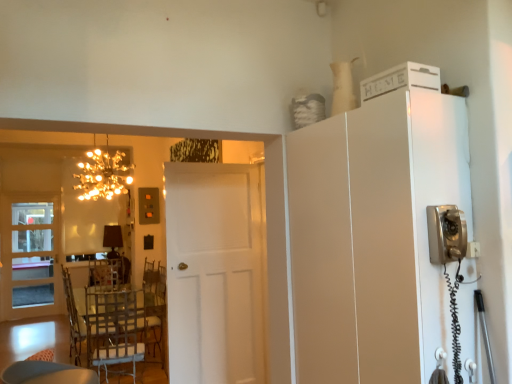
Question: Considering the positions of satin silver telephone at right, which is counted as the 1th appliance, starting from the front, and gold metallic chandelier at upper left in the image, is satin silver telephone at right, which is counted as the 1th appliance, starting from the front, wider or thinner than gold metallic chandelier at upper left?

Choices:
 (A) thin
 (B) wide

Answer: (A)

Question: From a real-world perspective, relative to gold metallic chandelier at upper left, is satin silver telephone at right, which is counted as the 1th appliance, starting from the front, vertically above or below?

Choices:
 (A) above
 (B) below

Answer: (B)

Question: Estimate the real-world distances between objects in this image. Which object is farther from the white matte cabinet at upper right?

Choices:
 (A) white matte door at center, positioned as the 2th door in left-to-right order
 (B) gold metallic chandelier at upper left
 (C) translucent glass door at left, the 1th door from the back
 (D) metallic silver chair at lower left
 (E) white matte cabinet at upper right, arranged as the 2th appliance when viewed from the front

Answer: (C)

Question: Which object is positioned farthest from the white matte cabinet at upper right?

Choices:
 (A) white matte cabinet at upper right, which is the 1th appliance in back-to-front order
 (B) satin silver telephone at right, which appears as the 2th appliance when viewed from the top
 (C) white matte door at center, which ranks as the first door in front-to-back order
 (D) translucent glass door at left, which appears as the first door when viewed from the left
 (E) gold metallic chandelier at upper left

Answer: (D)